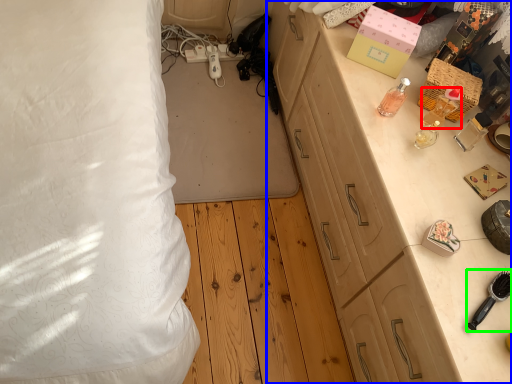
Question: Which object is positioned farthest from perfume (highlighted by a red box)? Select from cabinetry (highlighted by a blue box) and brush (highlighted by a green box).

Choices:
 (A) cabinetry
 (B) brush

Answer: (B)